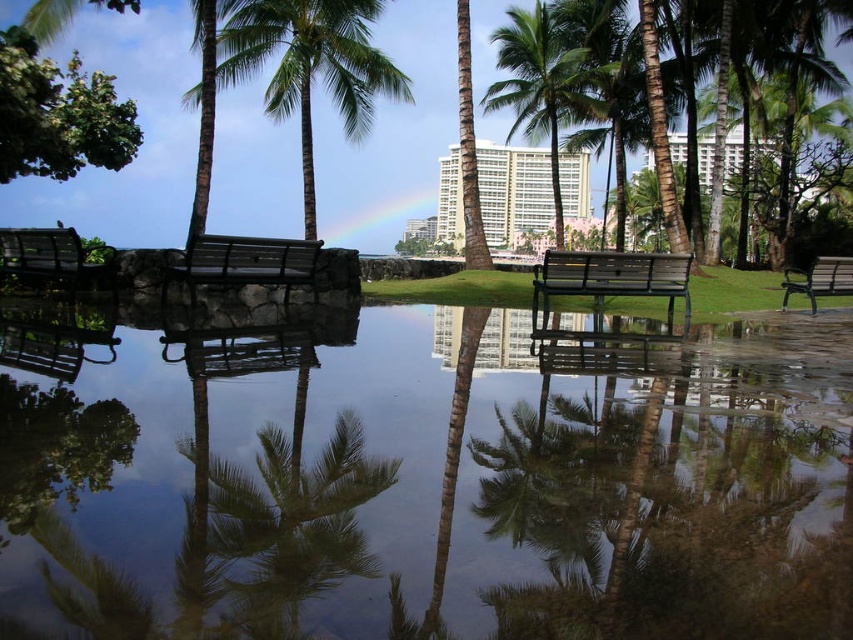
Does green leafy palm tree at center have a smaller size compared to metallic silver bench at left?

No.

Is green leafy palm tree at center bigger than metallic silver bench at left?

Yes.

Between point (547, 100) and point (59, 248), which one is positioned behind?

The point (547, 100) is behind.

At what (x,y) coordinates should I click in order to perform the action: click on green leafy palm tree at center. Please return your answer as a coordinate pair (x, y). Image resolution: width=853 pixels, height=640 pixels. Looking at the image, I should click on (543, 86).

Can you confirm if metallic silver bench at center is positioned to the left of metallic silver bench at left?

In fact, metallic silver bench at center is to the right of metallic silver bench at left.

This screenshot has width=853, height=640. What are the coordinates of `metallic silver bench at center` in the screenshot? It's located at (247, 260).

Between clear glass water at center and metallic green bench at right, which one appears on the right side from the viewer's perspective?

metallic green bench at right is more to the right.

Can you confirm if clear glass water at center is taller than metallic green bench at right?

No.

Does point (851, 502) come in front of point (795, 273)?

That is True.

The image size is (853, 640). In order to click on clear glass water at center in this screenshot , I will do `click(415, 493)`.